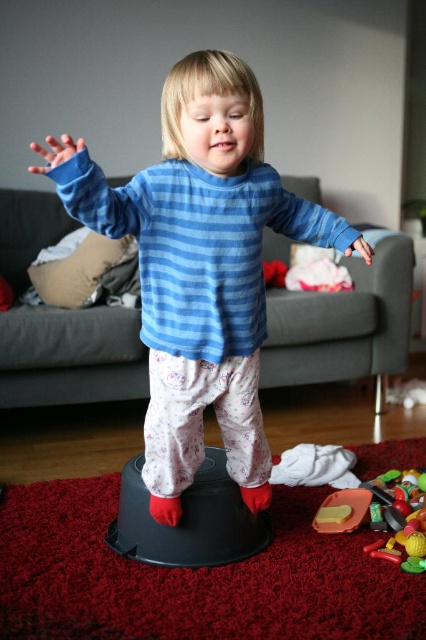
Question: Among these objects, which one is nearest to the camera?

Choices:
 (A) rubberized plastic toy at lower right
 (B) blue striped sweater at center

Answer: (B)

Question: Does blue striped sweater at center have a smaller size compared to rubberized plastic toy at lower right?

Choices:
 (A) no
 (B) yes

Answer: (A)

Question: Can you confirm if blue striped sweater at center is positioned below rubberized plastic toy at lower right?

Choices:
 (A) yes
 (B) no

Answer: (B)

Question: Which object appears closest to the camera in this image?

Choices:
 (A) blue striped sweater at center
 (B) rubberized plastic toy at lower right

Answer: (A)

Question: Is blue striped sweater at center above rubberized plastic toy at lower right?

Choices:
 (A) no
 (B) yes

Answer: (B)